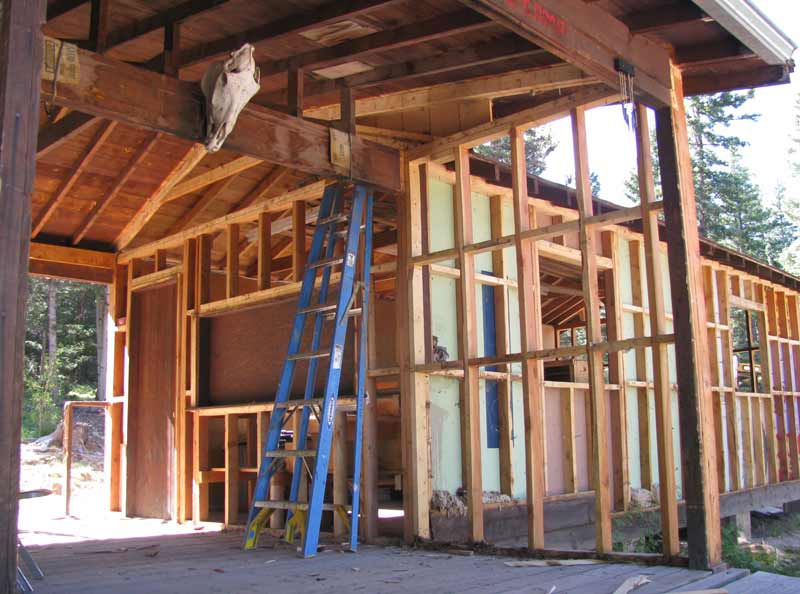
At what (x,y) coordinates should I click in order to perform the action: click on wooden frame. Please return your answer as a coordinate pair (x, y). Looking at the image, I should click on (x=684, y=210).